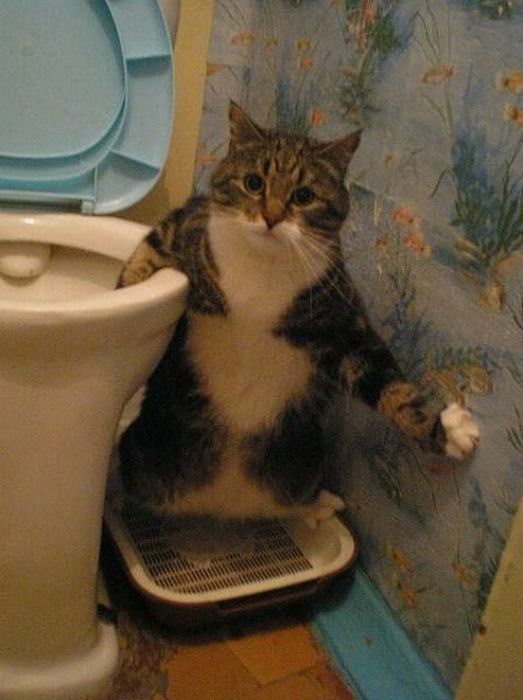
At what (x,y) coordinates should I click in order to perform the action: click on base of toilet. Please return your answer as a coordinate pair (x, y). The height and width of the screenshot is (700, 523). Looking at the image, I should click on (88, 673).